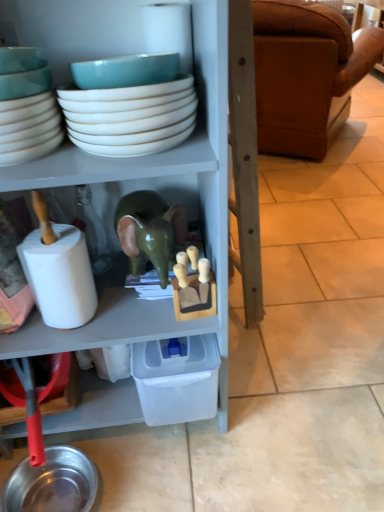
Question: From their relative heights in the image, would you say white matte toilet paper at left is taller or shorter than teal ceramic bowl at upper left, marked as the 2th bowl in a right-to-left arrangement?

Choices:
 (A) short
 (B) tall

Answer: (B)

Question: In terms of size, does white matte toilet paper at left appear bigger or smaller than teal ceramic bowl at upper left, marked as the 1th bowl in a left-to-right arrangement?

Choices:
 (A) big
 (B) small

Answer: (A)

Question: Estimate the real-world distances between objects in this image. Which object is farther from the white glossy bowls at upper center, which is the 2th bowl in left-to-right order?

Choices:
 (A) brown leather couch at right
 (B) metallic silver bowl at lower left
 (C) white matte toilet paper at left
 (D) teal ceramic bowl at upper left, marked as the 2th bowl in a right-to-left arrangement
 (E) green glossy elephant at center

Answer: (A)

Question: Which object is the farthest from the white matte toilet paper at left?

Choices:
 (A) brown leather couch at right
 (B) green glossy elephant at center
 (C) white glossy bowls at upper center, which is the 2th bowl in left-to-right order
 (D) teal ceramic bowl at upper left, marked as the 1th bowl in a left-to-right arrangement
 (E) metallic silver bowl at lower left

Answer: (A)